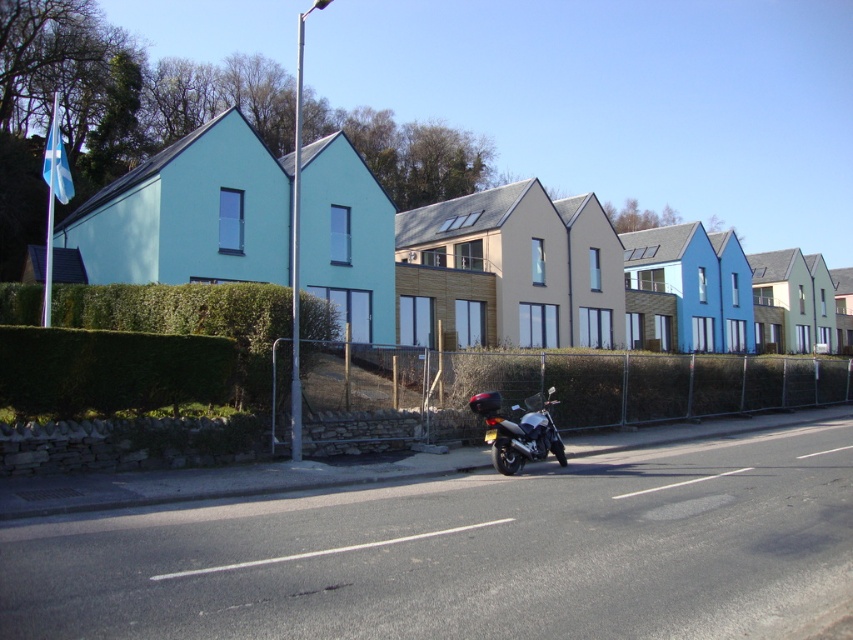
Question: Is green leafy hedge at left further to camera compared to silver metallic motorcycle at center?

Choices:
 (A) yes
 (B) no

Answer: (B)

Question: Which of the following is the closest to the observer?

Choices:
 (A) silver metallic motorcycle at center
 (B) green leafy hedge at left
 (C) white asphalt road at center

Answer: (C)

Question: Which object is positioned closest to the silver metallic motorcycle at center?

Choices:
 (A) green leafy hedge at left
 (B) white asphalt road at center

Answer: (B)

Question: Among these points, which one is nearest to the camera?

Choices:
 (A) (366, 547)
 (B) (554, 444)

Answer: (A)

Question: Is green leafy hedge at left positioned in front of silver metallic motorcycle at center?

Choices:
 (A) no
 (B) yes

Answer: (B)

Question: Can you confirm if green leafy hedge at left is positioned above white asphalt road at center?

Choices:
 (A) yes
 (B) no

Answer: (A)